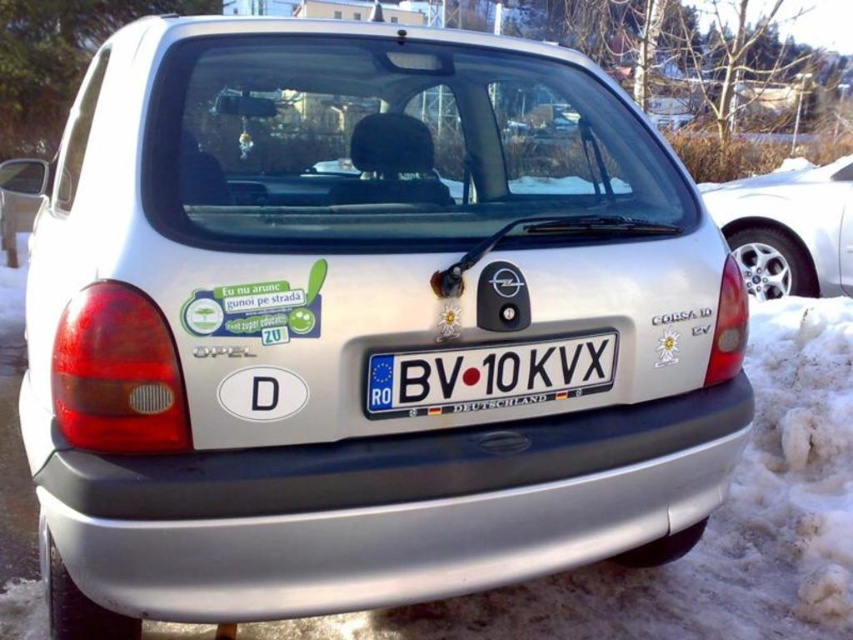
Which is more to the right, black rubber bumper at center or white glossy car at right?

white glossy car at right

Can you confirm if black rubber bumper at center is wider than white glossy car at right?

Yes, black rubber bumper at center is wider than white glossy car at right.

This screenshot has height=640, width=853. I want to click on black rubber bumper at center, so click(x=386, y=509).

Does white glossy car at right have a lesser width compared to blue metallic license plate at center?

No.

Describe the element at coordinates (788, 228) in the screenshot. Image resolution: width=853 pixels, height=640 pixels. I see `white glossy car at right` at that location.

Which is in front, point (845, 289) or point (401, 371)?

Positioned in front is point (401, 371).

Locate an element on the screen. This screenshot has height=640, width=853. white glossy car at right is located at coordinates (788, 228).

Does point (345, 461) lie behind point (587, 365)?

No, it is not.

Between black rubber bumper at center and blue metallic license plate at center, which one appears on the right side from the viewer's perspective?

From the viewer's perspective, blue metallic license plate at center appears more on the right side.

Is point (668, 477) closer to viewer compared to point (598, 358)?

No, it is behind (598, 358).

The height and width of the screenshot is (640, 853). I want to click on black rubber bumper at center, so click(x=386, y=509).